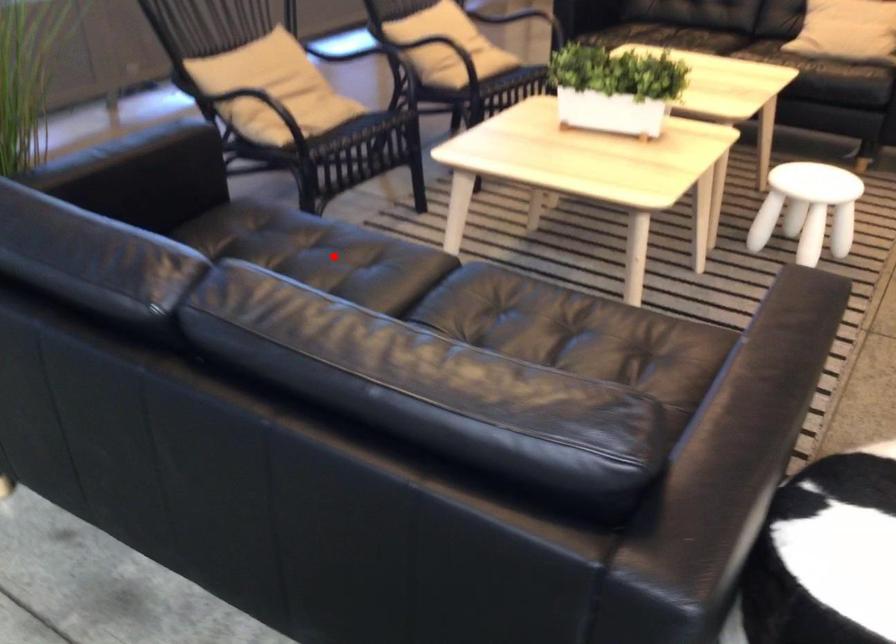
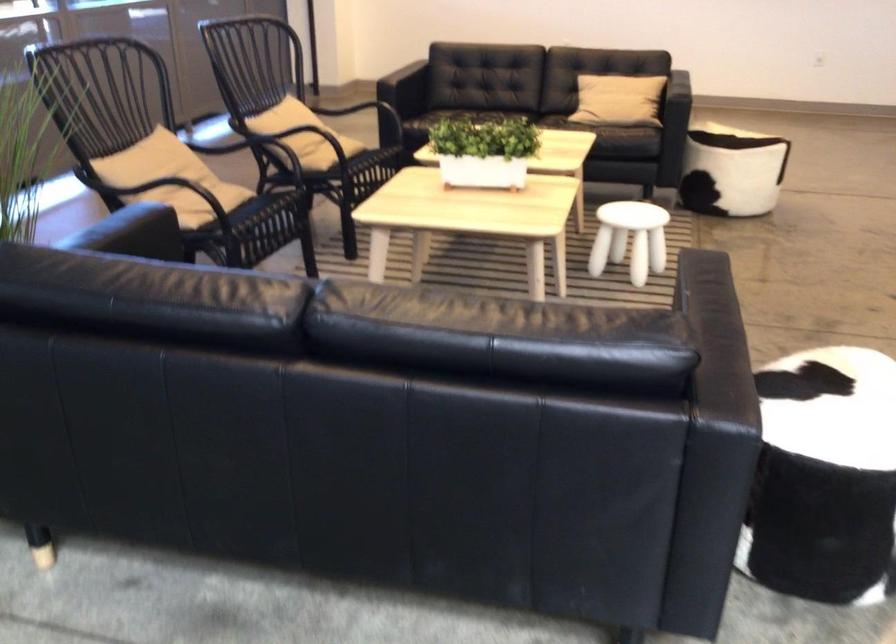
Question: I am providing you with two images of the same scene from different viewpoints. A red point is marked on the first image. At the location where the point appears in image 1, is it still visible in image 2?

Choices:
 (A) Yes
 (B) No

Answer: (B)